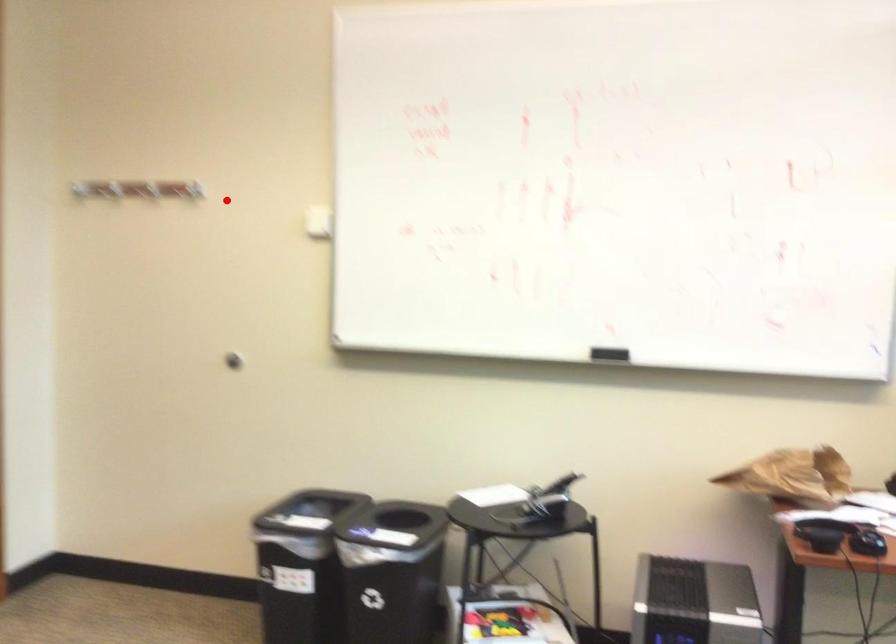
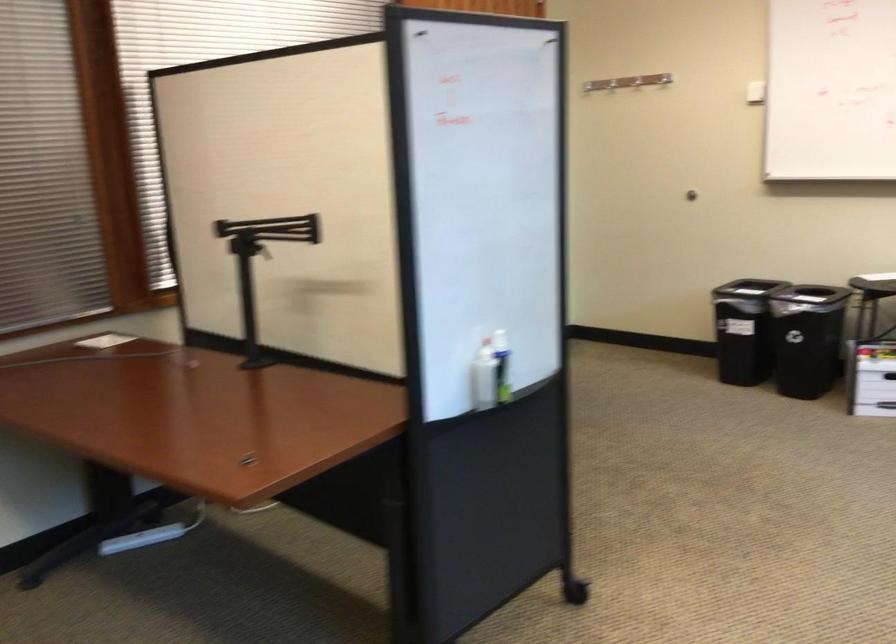
Question: I am providing you with two images of the same scene from different viewpoints. Image1 has a red point marked. In image2, the corresponding 3D location appears at what relative position? Reply with the corresponding letter.

Choices:
 (A) Closer
 (B) Farther

Answer: (B)